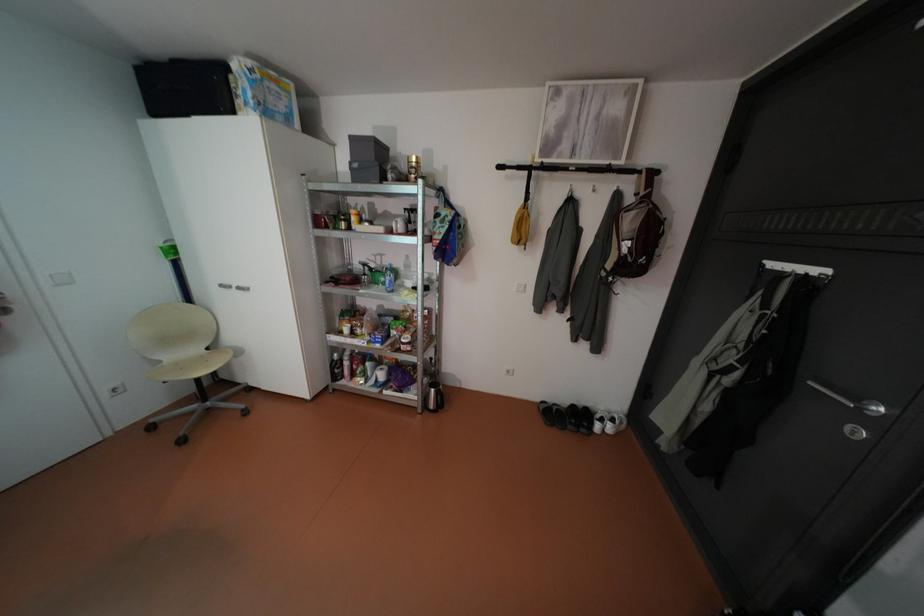
This screenshot has height=616, width=924. In order to click on metal coat hook in this screenshot , I will do `click(508, 168)`.